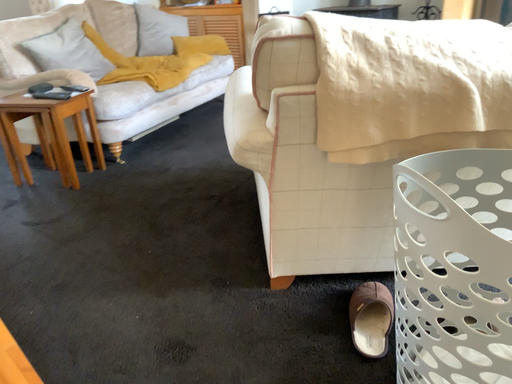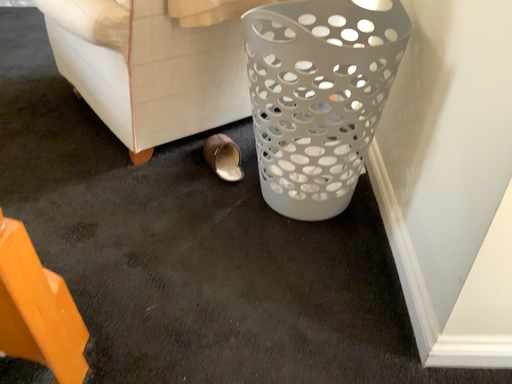
Question: How did the camera likely rotate when shooting the video?

Choices:
 (A) rotated downward
 (B) rotated upward

Answer: (A)